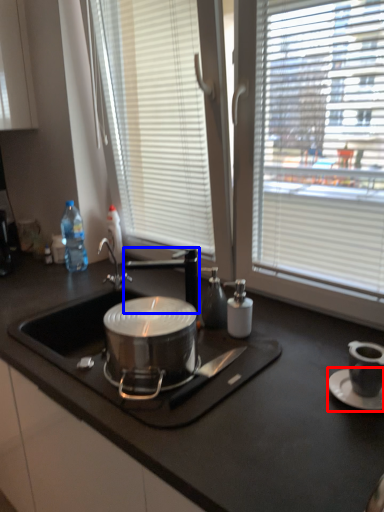
Question: Which object appears closest to the camera in this image, saucer (highlighted by a red box) or tap (highlighted by a blue box)?

Choices:
 (A) saucer
 (B) tap

Answer: (A)